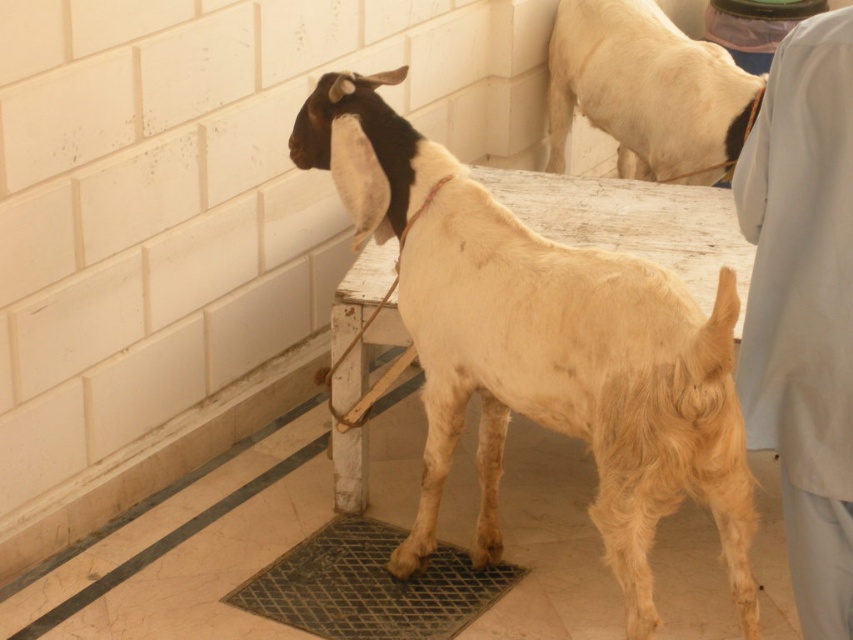
Who is more distant from viewer, [849,582] or [581,24]?

The point [581,24] is more distant.

Is point (814, 582) positioned after point (645, 106)?

No, it is not.

This screenshot has height=640, width=853. In order to click on light blue fabric at upper right in this screenshot , I will do `click(804, 308)`.

Who is positioned more to the left, light brown woolen goat at center or light blue fabric at upper right?

Positioned to the left is light brown woolen goat at center.

Looking at this image, is light brown woolen goat at center shorter than light blue fabric at upper right?

Incorrect, light brown woolen goat at center's height does not fall short of light blue fabric at upper right's.

At what (x,y) coordinates should I click in order to perform the action: click on light brown woolen goat at center. Please return your answer as a coordinate pair (x, y). Looking at the image, I should click on (546, 352).

At what (x,y) coordinates should I click in order to perform the action: click on light brown woolen goat at center. Please return your answer as a coordinate pair (x, y). The image size is (853, 640). Looking at the image, I should click on (546, 352).

Is point (340, 113) less distant than point (721, 138)?

Yes, it is.

Which is behind, point (488, 285) or point (646, 177)?

Point (646, 177)

This screenshot has width=853, height=640. Identify the location of light brown woolen goat at center. (546, 352).